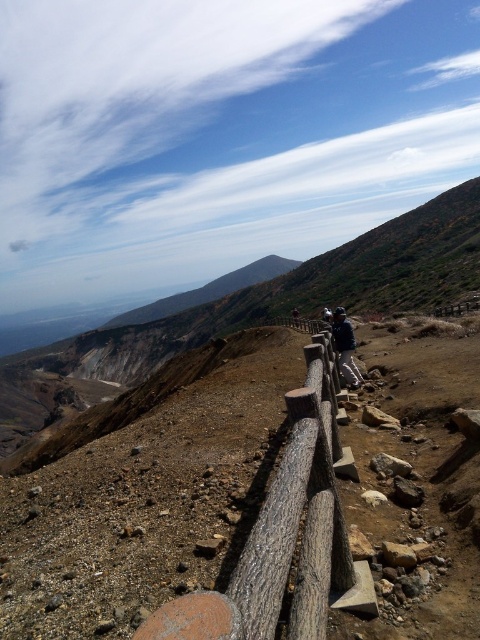
You are a hiker standing on the mountain path and see the wooden log rail at center and the dark blue jacket at center. Which object is positioned higher in the scene?

The dark blue jacket at center is positioned higher than the wooden log rail at center because the wooden log rail at center is located below it.

You are a hiker carrying a backpack and want to walk along the path near the wooden log rail at center and the dark blue jacket at center. Considering the path is narrow, can you safely pass through the area between them?

The wooden log rail at center might be wider than dark blue jacket at center, so there might not be enough space for you to pass safely between them. It is advisable to wait or find an alternative route.

You are a hiker standing at the point marked as point [282,532]. What is the nearest object to you?

The nearest object to you is the wooden log rail at center, as the point [282,532] is on the wooden log rail at center.